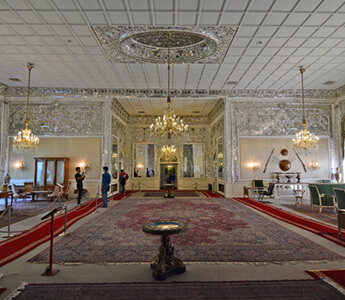
Find the location of a particular element. Image resolution: width=345 pixels, height=300 pixels. green seats is located at coordinates (319, 206), (257, 182), (339, 199).